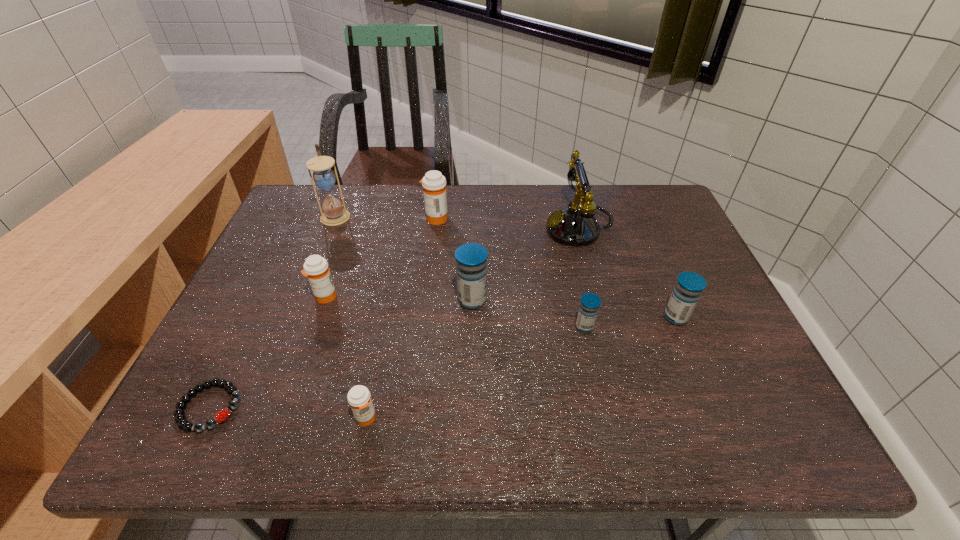
Identify the location of the second blue medicine from right to left. The image size is (960, 540). (589, 306).

You are a GUI agent. You are given a task and a screenshot of the screen. Output one action in this format:
    pyautogui.click(x=<x>, y=<y>)
    Task: Click on the fifth medicine from left to right
    This screenshot has height=540, width=960.
    Given the screenshot: What is the action you would take?
    pyautogui.click(x=589, y=306)

You are a GUI agent. You are given a task and a screenshot of the screen. Output one action in this format:
    pyautogui.click(x=<x>, y=<y>)
    Task: Click on the nearest orange medicine
    This screenshot has height=540, width=960.
    Given the screenshot: What is the action you would take?
    pyautogui.click(x=359, y=398)

Locate an element on the screen. The height and width of the screenshot is (540, 960). the smallest orange medicine is located at coordinates (359, 398).

Locate an element on the screen. bracelet is located at coordinates (180, 418).

Locate an element on the screen. black bracelet is located at coordinates (180, 418).

Identify the location of vacant point located on the left of the white hourglass. The image size is (960, 540). (301, 215).

Where is `vacant point located 0.110m on the dial of the black telephone`? vacant point located 0.110m on the dial of the black telephone is located at coordinates (508, 228).

The height and width of the screenshot is (540, 960). What are the coordinates of `vacant region located on the dial of the black telephone` in the screenshot? It's located at click(412, 228).

At what (x,y) coordinates should I click in order to perform the action: click on free point located 0.260m on the dial of the black telephone. Please return your answer as a coordinate pair (x, y). The height and width of the screenshot is (540, 960). Looking at the image, I should click on (456, 228).